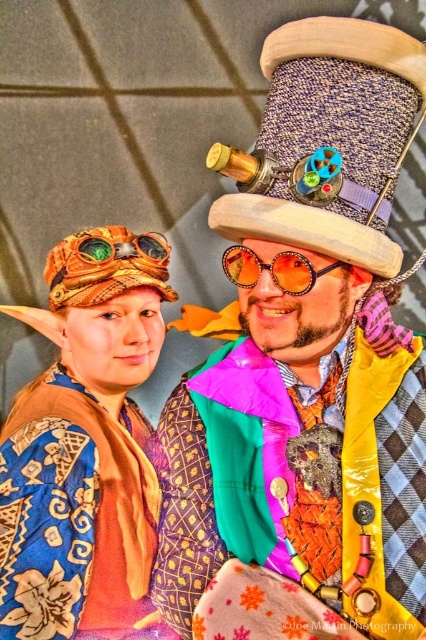
You are a photographer setting up for a photoshoot and need to ensure the two main subjects are positioned correctly. The subjects are wearing a woven fabric hat at upper center and a blue silk kimono at lower left. According to the scene description, how far apart are these two items in inches?

The woven fabric hat at upper center and blue silk kimono at lower left are 31.06 inches apart.

You are a photographer trying to capture a clear shot of the orange woven hat at upper left without the multicolored fabric coat at center blocking it. Based on their positions, is this possible?

The multicolored fabric coat at center is in front of the orange woven hat at upper left, so it will block the view. To capture the hat clearly, you need to adjust your angle or position to avoid the coat.